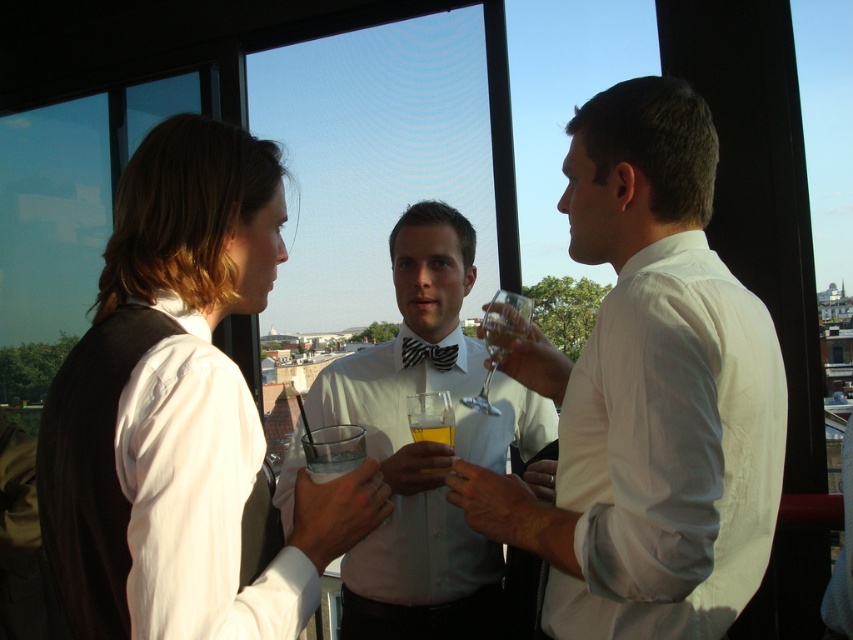
Question: Is matte white shirt at center smaller than white glossy bow tie at center?

Choices:
 (A) no
 (B) yes

Answer: (B)

Question: Which object is the closest to the clear glass wine glass at center?

Choices:
 (A) matte white shirt at center
 (B) white smooth shirt at center

Answer: (B)

Question: Which point is closer to the camera?

Choices:
 (A) black striped bow tie at center
 (B) white smooth shirt at center
 (C) clear glass at center
 (D) matte white shirt at center

Answer: (D)

Question: Is clear glass wine glass at center further to the viewer compared to black striped bow tie at center?

Choices:
 (A) yes
 (B) no

Answer: (B)

Question: Can you confirm if matte white shirt at center is thinner than translucent glass at center?

Choices:
 (A) no
 (B) yes

Answer: (A)

Question: Which of the following is the farthest from the observer?

Choices:
 (A) (329, 456)
 (B) (408, 225)
 (C) (519, 333)

Answer: (B)